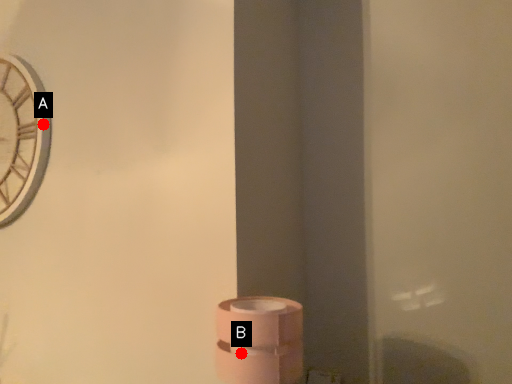
Question: Two points are circled on the image, labeled by A and B beside each circle. Among these points, which one is farthest from the camera?

Choices:
 (A) A is further
 (B) B is further

Answer: (A)